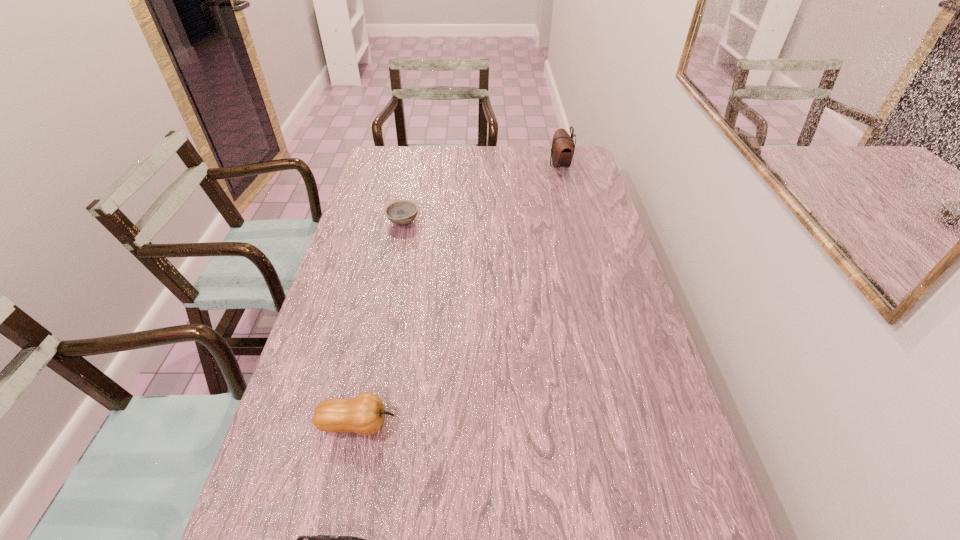
Where is `object that is at the far edge`? object that is at the far edge is located at coordinates (562, 151).

You are a GUI agent. You are given a task and a screenshot of the screen. Output one action in this format:
    pyautogui.click(x=<x>, y=<y>)
    Task: Click on the gourd present at the left edge
    This screenshot has width=960, height=540.
    Given the screenshot: What is the action you would take?
    pyautogui.click(x=364, y=414)

The height and width of the screenshot is (540, 960). In order to click on bowl located in the left edge section of the desktop in this screenshot , I will do `click(401, 212)`.

Find the location of `object that is at the right edge`. object that is at the right edge is located at coordinates (562, 151).

Locate an element on the screen. object that is at the far right corner is located at coordinates (562, 151).

The width and height of the screenshot is (960, 540). I want to click on blank area at the far edge, so click(x=444, y=168).

Identify the location of free space at the left edge of the desktop. (396, 188).

I want to click on vacant area at the right edge of the desktop, so click(x=624, y=473).

Locate an element on the screen. The width and height of the screenshot is (960, 540). vacant region at the far left corner of the desktop is located at coordinates (392, 156).

I want to click on vacant space at the far right corner, so click(585, 170).